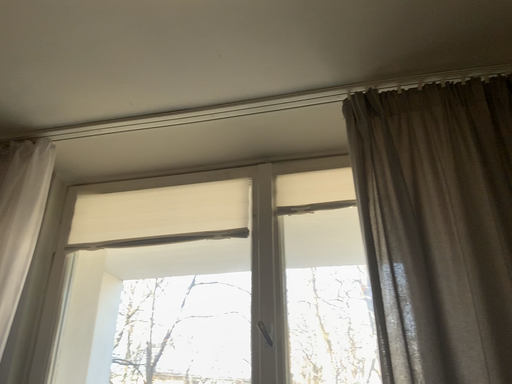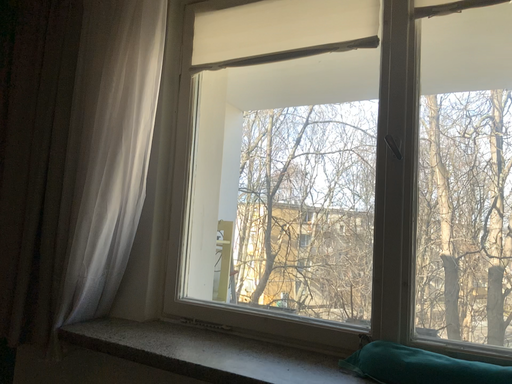
Question: Which way did the camera rotate in the video?

Choices:
 (A) rotated upward
 (B) rotated downward

Answer: (B)